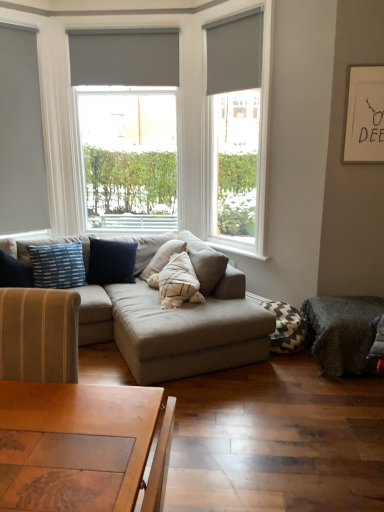
Find the location of a particular element. free space above matte gray blind at upper center, which is the second blind from right to left (from a real-world perspective) is located at coordinates (125, 27).